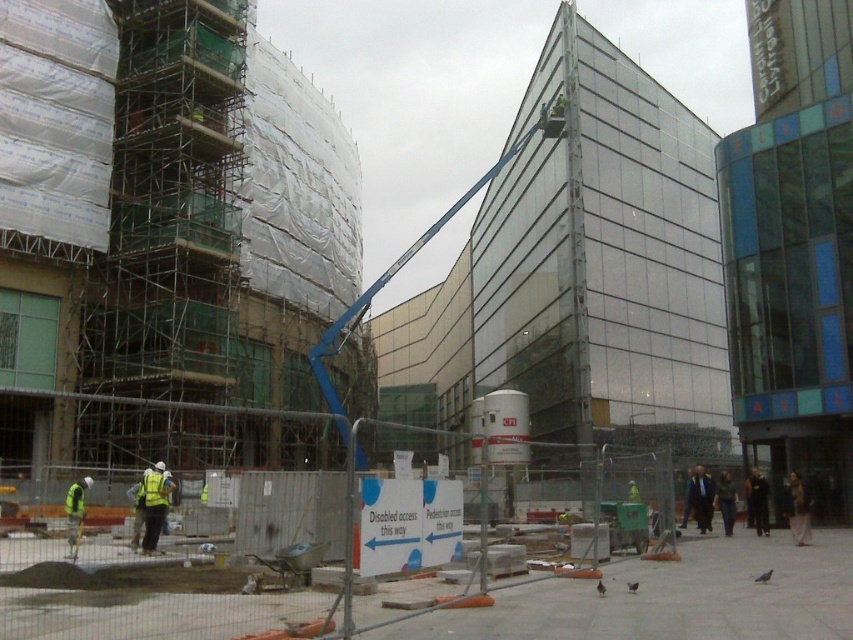
Which is behind, point (163, 476) or point (82, 488)?

The point (82, 488) is behind.

Where is `reflective yellow vest at lower left`? Image resolution: width=853 pixels, height=640 pixels. reflective yellow vest at lower left is located at coordinates (154, 502).

Locate an element on the screen. reflective yellow vest at lower left is located at coordinates (154, 502).

Measure the distance between reflective yellow vest at lower left and yellow reflective safety vest at lower left.

reflective yellow vest at lower left and yellow reflective safety vest at lower left are 3.55 feet apart.

Is reflective yellow vest at lower left closer to the viewer compared to yellow reflective safety vest at lower left?

Yes, reflective yellow vest at lower left is in front of yellow reflective safety vest at lower left.

Between point (152, 529) and point (160, 470), which one is positioned in front?

Point (152, 529) is more forward.

Image resolution: width=853 pixels, height=640 pixels. I want to click on reflective yellow vest at lower left, so click(154, 502).

Looking at this image, is silver metallic scaffolding at left positioned at the back of reflective yellow vest at lower left?

Yes, silver metallic scaffolding at left is behind reflective yellow vest at lower left.

Locate an element on the screen. The height and width of the screenshot is (640, 853). silver metallic scaffolding at left is located at coordinates (169, 208).

Identify the location of silver metallic scaffolding at left. The image size is (853, 640). (169, 208).